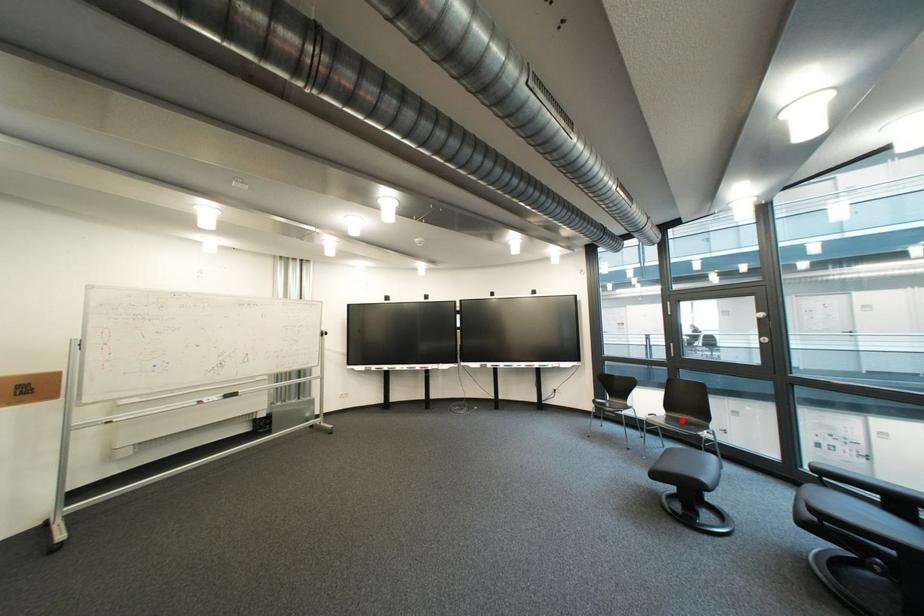
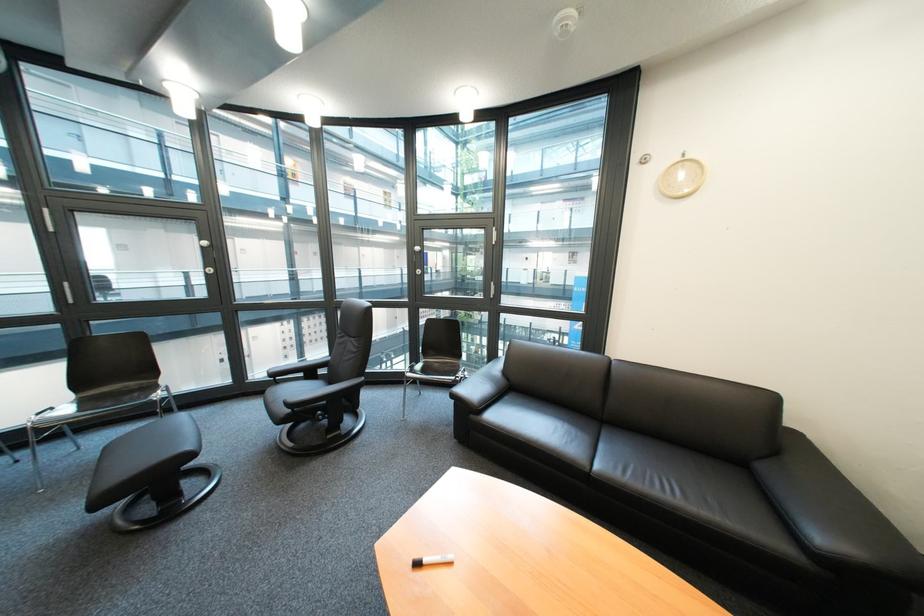
Question: I am providing you with two images of the same scene from different viewpoints. Image1 has a red point marked. In image2, the corresponding 3D location appears at what relative position? Reply with the corresponding letter.

Choices:
 (A) Closer
 (B) Farther

Answer: (A)